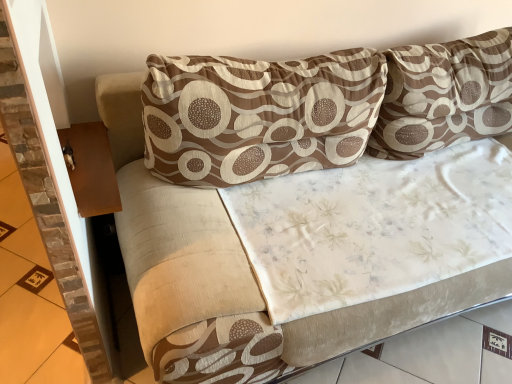
Question: Can you confirm if brown textured pillow at upper right, acting as the second pillow starting from the left, is positioned to the left of brown stone tile at left?

Choices:
 (A) yes
 (B) no

Answer: (B)

Question: Does brown textured pillow at upper right, the first pillow when ordered from right to left, have a lesser width compared to brown stone tile at left?

Choices:
 (A) no
 (B) yes

Answer: (B)

Question: Is brown textured pillow at upper right, the first pillow when ordered from right to left, located outside brown stone tile at left?

Choices:
 (A) no
 (B) yes

Answer: (B)

Question: Can you confirm if brown textured pillow at upper right, acting as the second pillow starting from the left, is wider than brown stone tile at left?

Choices:
 (A) yes
 (B) no

Answer: (B)

Question: Is brown stone tile at left at the back of brown textured pillow at upper right, acting as the second pillow starting from the left?

Choices:
 (A) no
 (B) yes

Answer: (A)

Question: Considering the relative positions of brown textured pillow at upper right, the first pillow when ordered from right to left, and brown stone tile at left in the image provided, is brown textured pillow at upper right, the first pillow when ordered from right to left, to the right of brown stone tile at left from the viewer's perspective?

Choices:
 (A) yes
 (B) no

Answer: (A)

Question: Is brown stone tile at left oriented towards brown wood table at left?

Choices:
 (A) no
 (B) yes

Answer: (A)

Question: From a real-world perspective, is brown stone tile at left physically above brown wood table at left?

Choices:
 (A) yes
 (B) no

Answer: (B)

Question: From a real-world perspective, is brown stone tile at left beneath brown wood table at left?

Choices:
 (A) yes
 (B) no

Answer: (A)

Question: Is brown stone tile at left wider than brown wood table at left?

Choices:
 (A) no
 (B) yes

Answer: (B)

Question: Does brown stone tile at left have a greater height compared to brown wood table at left?

Choices:
 (A) no
 (B) yes

Answer: (B)

Question: Are brown stone tile at left and brown wood table at left making contact?

Choices:
 (A) no
 (B) yes

Answer: (A)

Question: From the image's perspective, is brown wood table at left beneath brown textured pillow at center, positioned as the first pillow in left-to-right order?

Choices:
 (A) no
 (B) yes

Answer: (B)